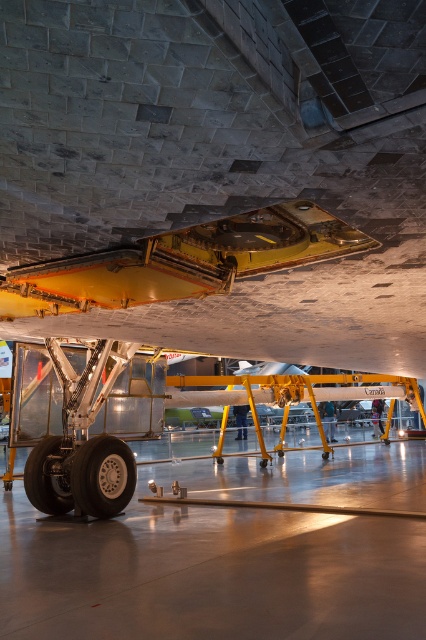
Which is more to the left, metallic yellow wing at center or shiny silver tire at lower left?

From the viewer's perspective, shiny silver tire at lower left appears more on the left side.

Find the location of a particular element. metallic yellow wing at center is located at coordinates (181, 262).

Find the location of `metallic yellow wing at center`. metallic yellow wing at center is located at coordinates (181, 262).

Is metallic yellow wing at center smaller than shiny black tire at lower left?

No, metallic yellow wing at center is not smaller than shiny black tire at lower left.

Which is behind, point (100, 269) or point (60, 461)?

The point (60, 461) is more distant.

Locate an element on the screen. This screenshot has height=640, width=426. metallic yellow wing at center is located at coordinates coord(181,262).

Can you confirm if shiny silver tire at lower left is wider than shiny black tire at lower left?

Yes.

Can you confirm if shiny silver tire at lower left is taller than shiny black tire at lower left?

In fact, shiny silver tire at lower left may be shorter than shiny black tire at lower left.

Describe the element at coordinates (103, 476) in the screenshot. This screenshot has width=426, height=640. I see `shiny silver tire at lower left` at that location.

Image resolution: width=426 pixels, height=640 pixels. Find the location of `shiny silver tire at lower left`. shiny silver tire at lower left is located at coordinates pos(103,476).